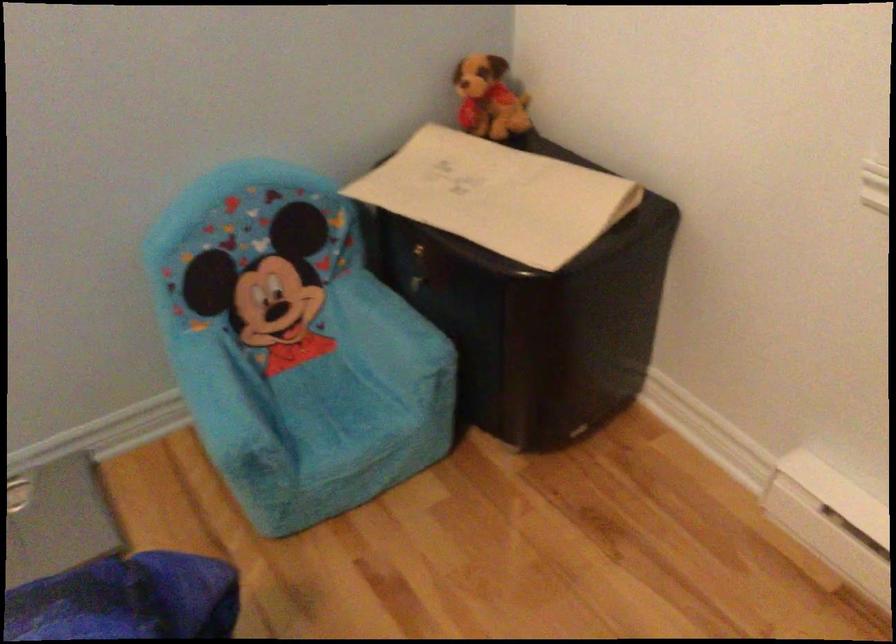
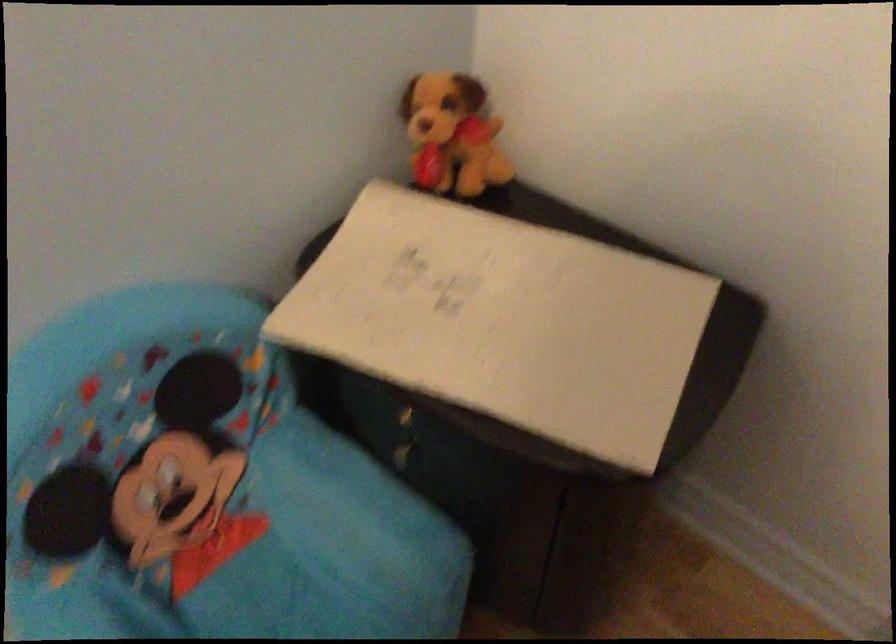
Locate, in the second image, the point that corresponds to the point at 418,272 in the first image.

(403, 438)